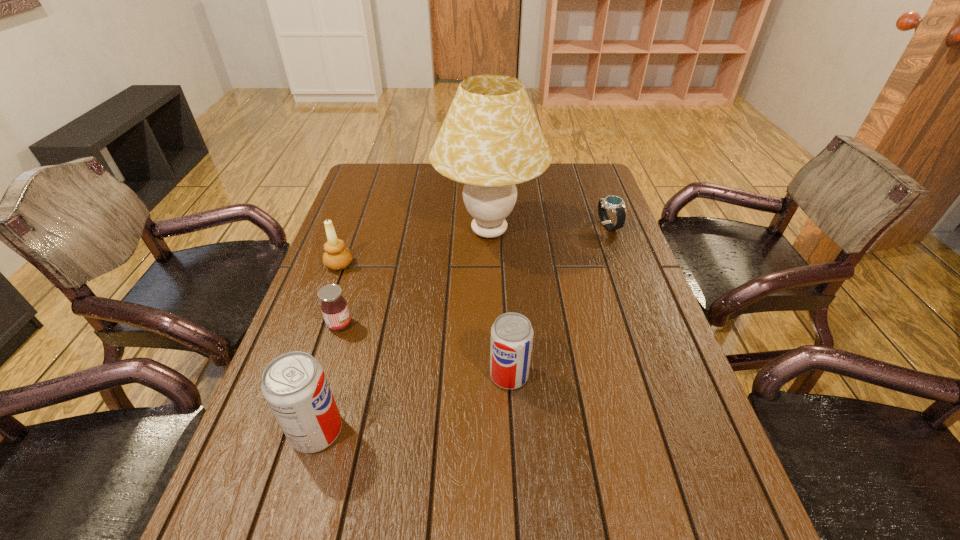
Locate an element on the screen. This screenshot has height=540, width=960. object situated at the right edge is located at coordinates (616, 204).

Find the location of a particular element. object located in the near left corner section of the desktop is located at coordinates (294, 384).

The height and width of the screenshot is (540, 960). In the image, there is a desktop. What are the coordinates of `free space at the near edge` in the screenshot? It's located at (390, 474).

This screenshot has width=960, height=540. I want to click on blank area at the left edge, so click(377, 230).

The image size is (960, 540). Find the location of `free space at the right edge of the desktop`. free space at the right edge of the desktop is located at coordinates (568, 211).

The image size is (960, 540). In the image, there is a desktop. In order to click on vacant space at the far left corner in this screenshot , I will do `click(379, 185)`.

The image size is (960, 540). In the image, there is a desktop. In order to click on free space at the far right corner in this screenshot , I will do `click(576, 166)`.

Image resolution: width=960 pixels, height=540 pixels. Find the location of `unoccupied position between the rightmost object and the right soda`. unoccupied position between the rightmost object and the right soda is located at coordinates (559, 300).

The height and width of the screenshot is (540, 960). In order to click on free space between the tallest object and the shorter soda in this screenshot , I will do `click(499, 303)`.

This screenshot has width=960, height=540. In order to click on empty space between the second tallest object and the jam in this screenshot , I will do `click(328, 377)`.